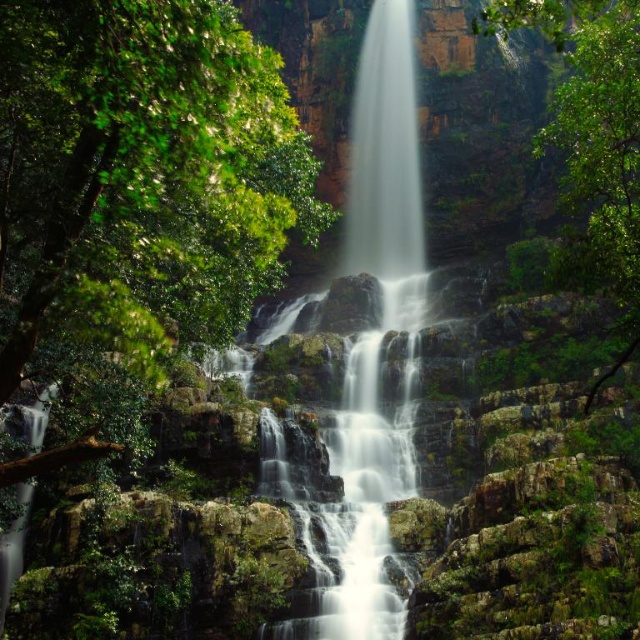
Question: Which is nearer to the white smooth waterfall at center?

Choices:
 (A) green leafy tree at right
 (B) green leafy tree at upper left

Answer: (A)

Question: Which point appears farthest from the camera in this image?

Choices:
 (A) (636, 125)
 (B) (268, 51)
 (C) (388, 163)

Answer: (C)

Question: Does green leafy tree at upper left appear on the right side of white smooth waterfall at center?

Choices:
 (A) no
 (B) yes

Answer: (A)

Question: Does green leafy tree at upper left have a greater width compared to green leafy tree at right?

Choices:
 (A) no
 (B) yes

Answer: (A)

Question: Which of the following is the farthest from the observer?

Choices:
 (A) (360, 547)
 (B) (568, 152)
 (C) (84, 262)

Answer: (B)

Question: Is white smooth waterfall at center closer to the viewer compared to green leafy tree at right?

Choices:
 (A) yes
 (B) no

Answer: (B)